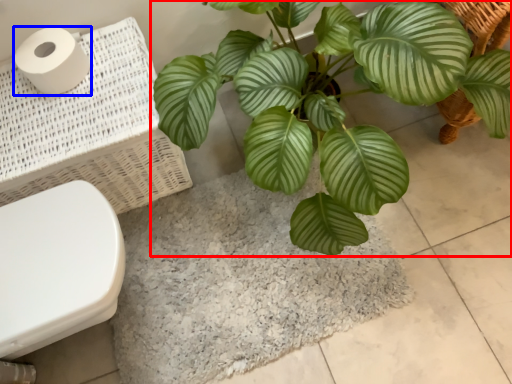
Question: Which object is closer to the camera taking this photo, houseplant (highlighted by a red box) or toilet paper (highlighted by a blue box)?

Choices:
 (A) houseplant
 (B) toilet paper

Answer: (A)